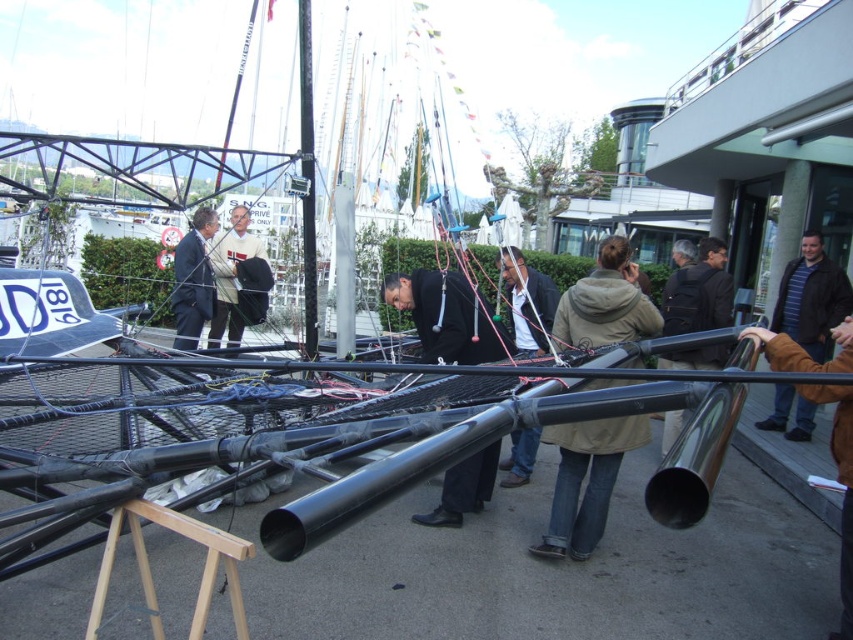
Find the location of `black matte suit at center`. black matte suit at center is located at coordinates (447, 317).

Does black matte suit at center appear on the right side of white knit sweater at center?

Correct, you'll find black matte suit at center to the right of white knit sweater at center.

Does point (445, 483) lie in front of point (236, 252)?

Yes, it is in front of point (236, 252).

Locate an element on the screen. Image resolution: width=853 pixels, height=640 pixels. black matte suit at center is located at coordinates (447, 317).

Does dark brown leather jacket at center have a greater width compared to black matte pole at center?

Yes, dark brown leather jacket at center is wider than black matte pole at center.

Is point (670, 362) positioned in front of point (305, 120)?

No, (670, 362) is behind (305, 120).

Which is behind, point (714, 300) or point (315, 317)?

The point (714, 300) is more distant.

The width and height of the screenshot is (853, 640). I want to click on dark brown leather jacket at center, so click(699, 292).

Who is more forward, [527,320] or [183,284]?

Point [527,320] is in front.

Can you confirm if matte black jacket at center is thinner than matte black suit at center?

In fact, matte black jacket at center might be wider than matte black suit at center.

Is point (500, 465) positioned in front of point (196, 275)?

Yes, it is.

Locate an element on the screen. matte black jacket at center is located at coordinates (527, 301).